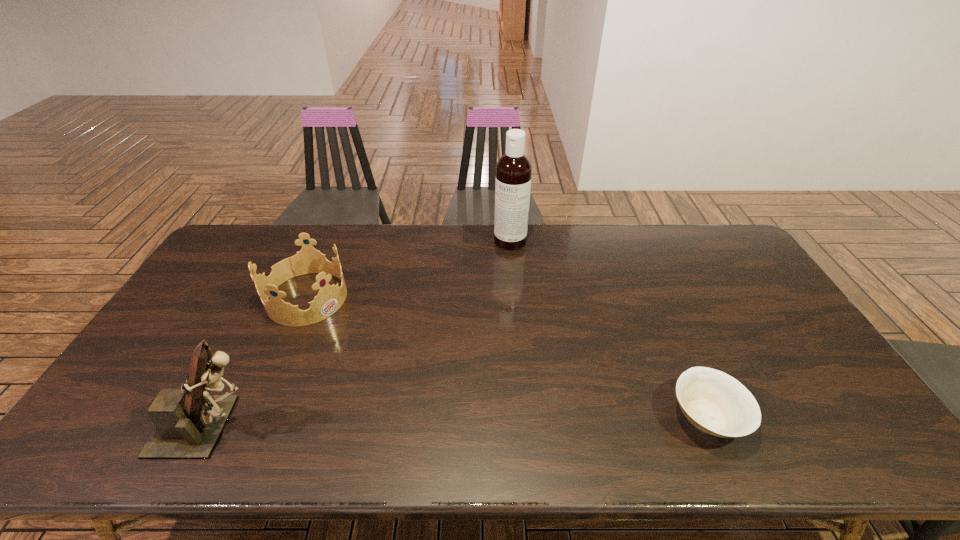
Locate an element on the screen. vacant region located 0.110m on the front-facing side of the second farthest object is located at coordinates (358, 330).

Locate an element on the screen. Image resolution: width=960 pixels, height=540 pixels. vacant space located on the label side of the second object from right to left is located at coordinates (500, 260).

Where is `free space located on the label side of the second object from right to left`? This screenshot has width=960, height=540. free space located on the label side of the second object from right to left is located at coordinates (500, 260).

Image resolution: width=960 pixels, height=540 pixels. I want to click on vacant region located on the label side of the second object from right to left, so click(495, 269).

Image resolution: width=960 pixels, height=540 pixels. What are the coordinates of `object present at the far edge` in the screenshot? It's located at (513, 169).

Locate an element on the screen. This screenshot has height=540, width=960. figurine located in the near edge section of the desktop is located at coordinates (189, 421).

Find the location of `bowl at the near edge`. bowl at the near edge is located at coordinates (714, 402).

In order to click on object at the left edge in this screenshot , I will do `click(189, 421)`.

You are a GUI agent. You are given a task and a screenshot of the screen. Output one action in this format:
    pyautogui.click(x=<x>, y=<y>)
    Task: Click on the object that is at the near left corner
    This screenshot has width=960, height=540.
    Given the screenshot: What is the action you would take?
    pyautogui.click(x=189, y=421)

Identify the location of vacant position at the far edge of the desktop. Image resolution: width=960 pixels, height=540 pixels. (559, 262).